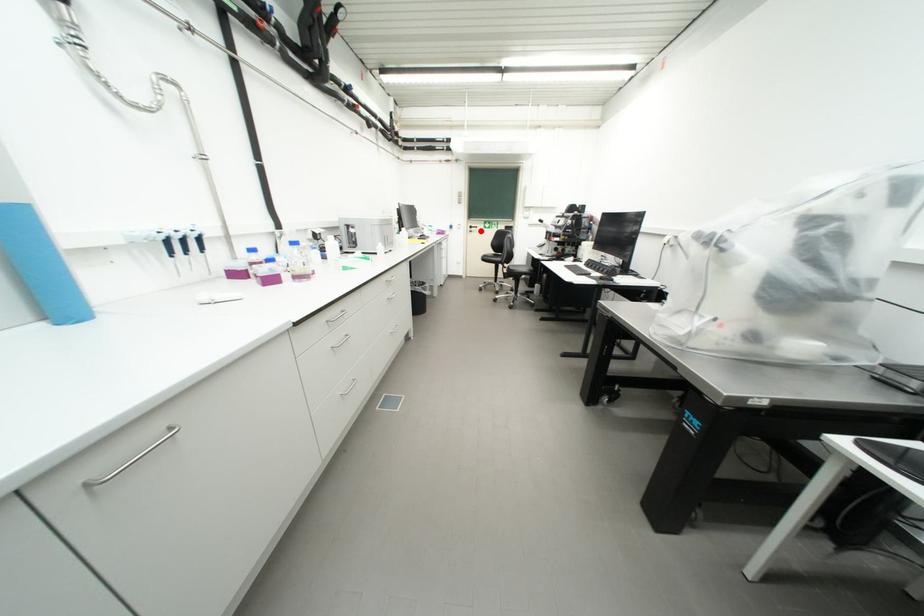
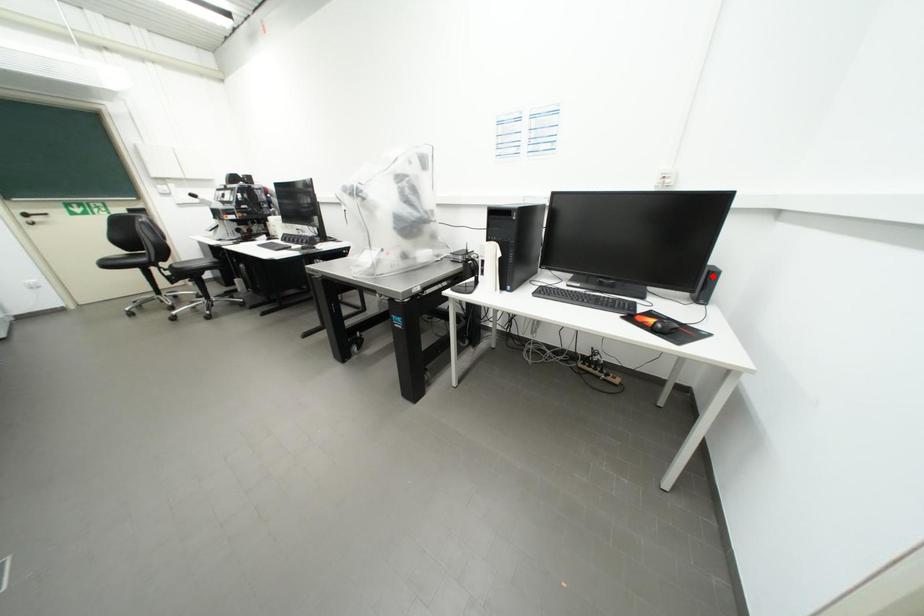
I am providing you with two images of the same scene from different viewpoints. A red point is marked on the first image and another point is marked on the second image. Does the point marked in image1 correspond to the same location as the one in image2?

No